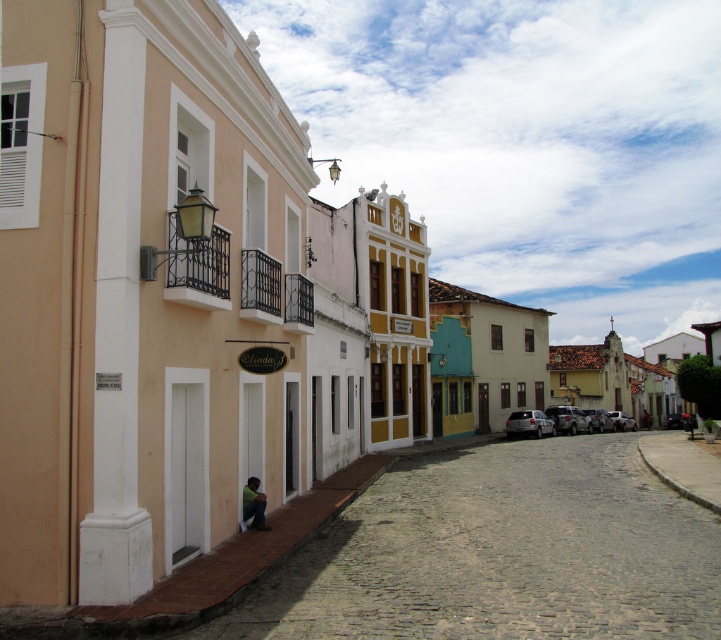
Measure the distance between point [380,484] and camera.

They are 17.57 meters apart.

Does white painted wall at lower left have a lesser width compared to dark green fabric at lower center?

No, white painted wall at lower left is not thinner than dark green fabric at lower center.

Measure the distance between point (562, 589) and camera.

25.61 feet

Locate an element on the screen. white painted wall at lower left is located at coordinates (500, 552).